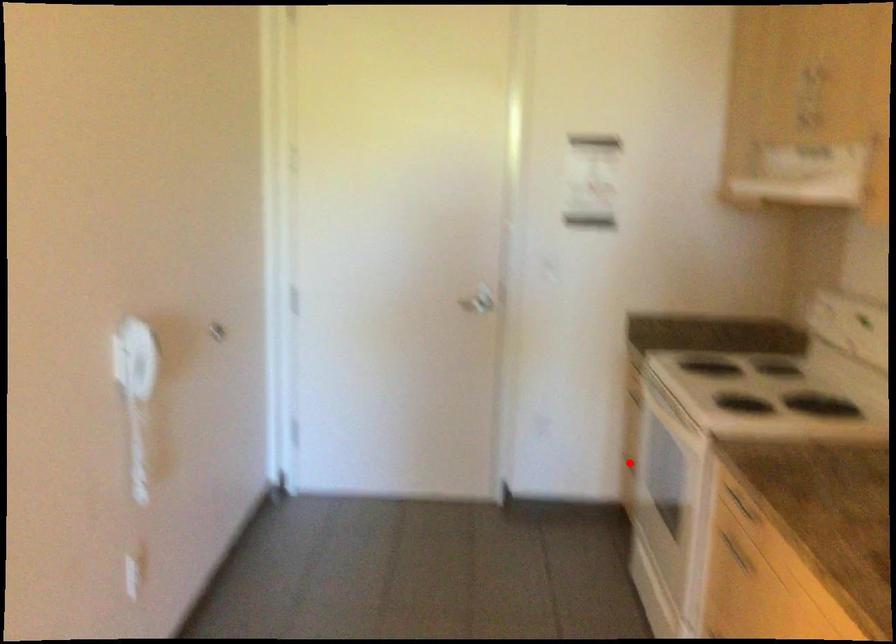
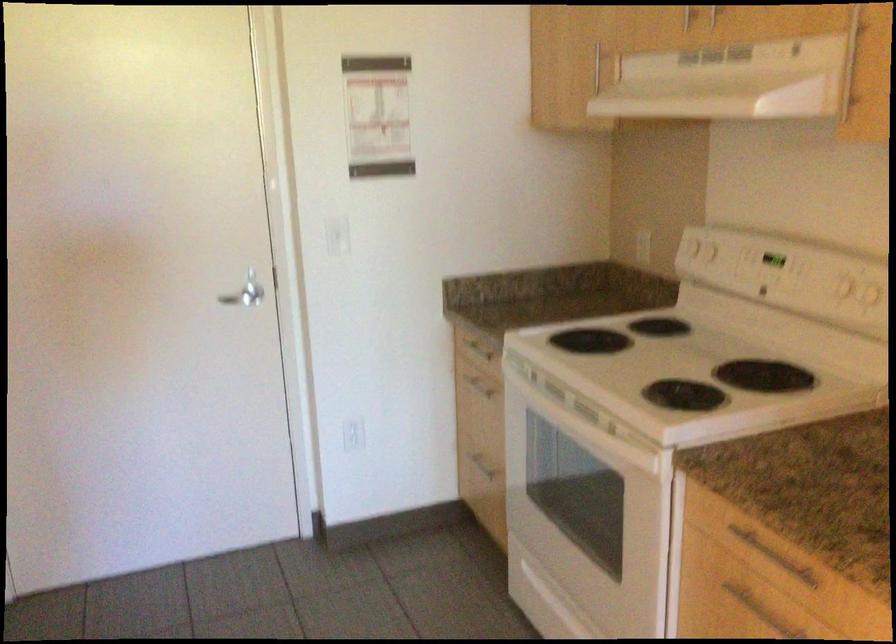
Question: I am providing you with two images of the same scene from different viewpoints. A red point is shown in image1. For the corresponding object point in image2, is it positioned nearer or farther from the camera?

Choices:
 (A) Nearer
 (B) Farther

Answer: (A)